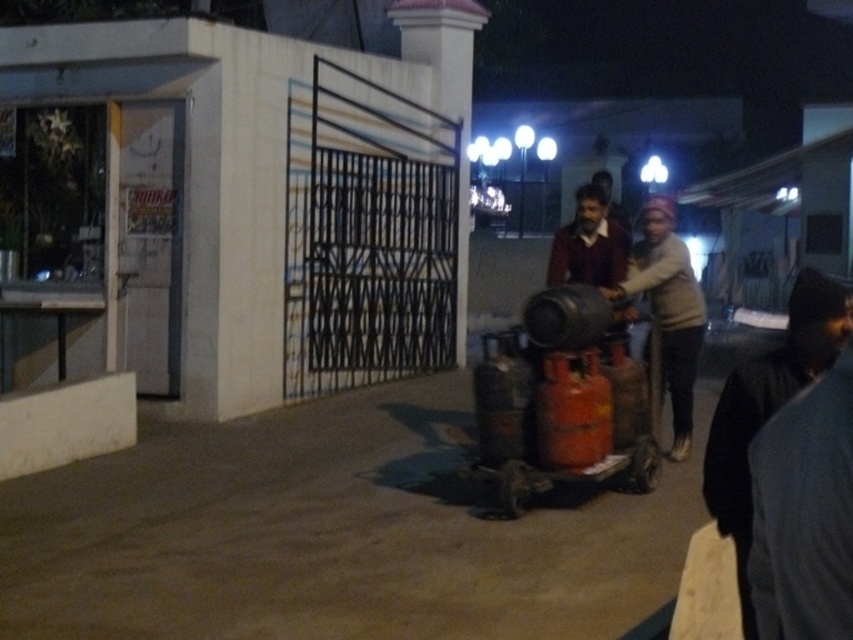
Describe the element at coordinates (668, 308) in the screenshot. Image resolution: width=853 pixels, height=640 pixels. I see `light gray cotton sweater at center` at that location.

Is light gray cotton sweater at center further to camera compared to white concrete pillar at center?

No, light gray cotton sweater at center is in front of white concrete pillar at center.

What do you see at coordinates (668, 308) in the screenshot? I see `light gray cotton sweater at center` at bounding box center [668, 308].

At what (x,y) coordinates should I click in order to perform the action: click on light gray cotton sweater at center. Please return your answer as a coordinate pair (x, y). The image size is (853, 640). Looking at the image, I should click on (668, 308).

Which is below, black fabric at lower right or white concrete pillar at center?

Positioned lower is black fabric at lower right.

Locate an element on the screen. The width and height of the screenshot is (853, 640). black fabric at lower right is located at coordinates (769, 408).

The width and height of the screenshot is (853, 640). In order to click on black fabric at lower right in this screenshot , I will do `click(769, 408)`.

Does black fabric at lower right have a greater width compared to light gray cotton sweater at center?

Indeed, black fabric at lower right has a greater width compared to light gray cotton sweater at center.

How distant is black fabric at lower right from light gray cotton sweater at center?

The distance of black fabric at lower right from light gray cotton sweater at center is 8.54 feet.

Is point (734, 467) farther from camera compared to point (669, 214)?

That is False.

What are the coordinates of `black fabric at lower right` in the screenshot? It's located at (769, 408).